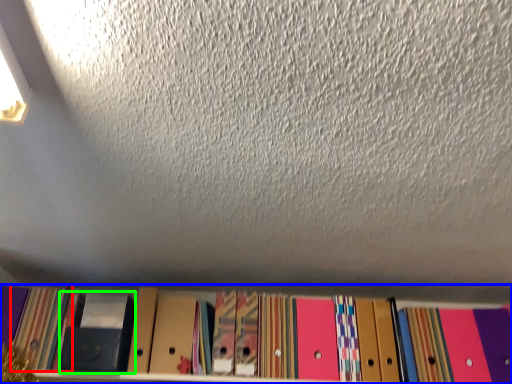
Question: Which object is the farthest from paperback book (highlighted by a red box)? Choose among these: shelf (highlighted by a blue box) or paperback book (highlighted by a green box).

Choices:
 (A) shelf
 (B) paperback book

Answer: (A)